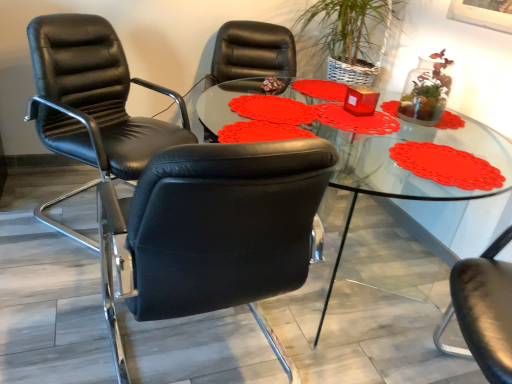
Image resolution: width=512 pixels, height=384 pixels. I want to click on free point below black leather chair at left, marked as the first chair in a front-to-back arrangement (from a real-world perspective), so click(178, 350).